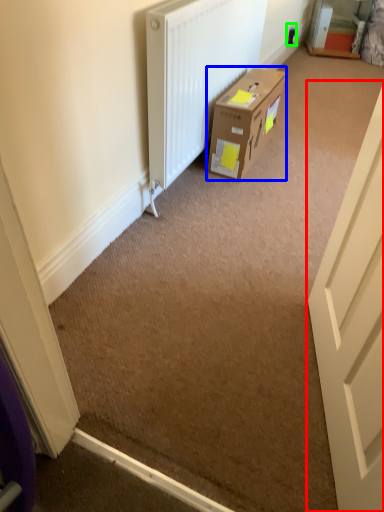
Question: Considering the real-world distances, which object is farthest from door (highlighted by a red box)? box (highlighted by a blue box) or electric outlet (highlighted by a green box)?

Choices:
 (A) box
 (B) electric outlet

Answer: (B)